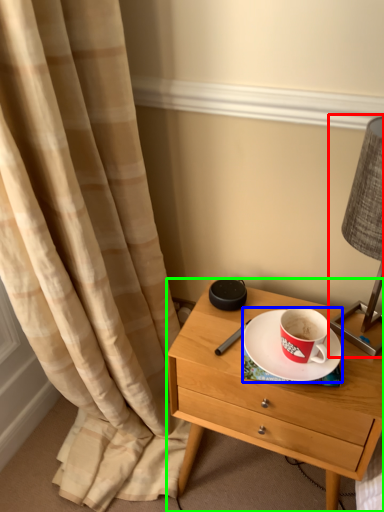
Question: Estimate the real-world distances between objects in this image. Which object is farther from bedside lamp (highlighted by a red box), saucer (highlighted by a blue box) or nightstand (highlighted by a green box)?

Choices:
 (A) saucer
 (B) nightstand

Answer: (B)